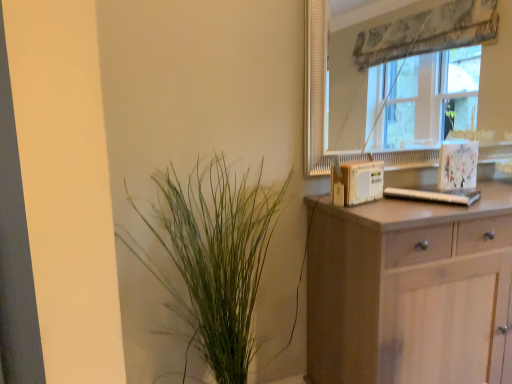
Question: From the image's perspective, does transparent glass window at upper right appear lower than light brown wooden chest of drawers at right?

Choices:
 (A) no
 (B) yes

Answer: (A)

Question: From a real-world perspective, is transparent glass window at upper right under light brown wooden chest of drawers at right?

Choices:
 (A) no
 (B) yes

Answer: (A)

Question: Is transparent glass window at upper right bigger than light brown wooden chest of drawers at right?

Choices:
 (A) no
 (B) yes

Answer: (A)

Question: From the image's perspective, is transparent glass window at upper right on top of light brown wooden chest of drawers at right?

Choices:
 (A) yes
 (B) no

Answer: (A)

Question: From a real-world perspective, is transparent glass window at upper right located higher than light brown wooden chest of drawers at right?

Choices:
 (A) yes
 (B) no

Answer: (A)

Question: Is transparent glass window at upper right in front of light brown wooden chest of drawers at right?

Choices:
 (A) no
 (B) yes

Answer: (A)

Question: Is green leafy plant at left taller than transparent glass window at upper right?

Choices:
 (A) yes
 (B) no

Answer: (A)

Question: Considering the relative sizes of green leafy plant at left and transparent glass window at upper right in the image provided, is green leafy plant at left smaller than transparent glass window at upper right?

Choices:
 (A) no
 (B) yes

Answer: (A)

Question: From a real-world perspective, is green leafy plant at left located beneath transparent glass window at upper right?

Choices:
 (A) yes
 (B) no

Answer: (A)

Question: Is green leafy plant at left wider than transparent glass window at upper right?

Choices:
 (A) no
 (B) yes

Answer: (B)

Question: From a real-world perspective, is green leafy plant at left positioned over transparent glass window at upper right based on gravity?

Choices:
 (A) no
 (B) yes

Answer: (A)

Question: Is green leafy plant at left positioned behind transparent glass window at upper right?

Choices:
 (A) yes
 (B) no

Answer: (B)

Question: Considering the relative sizes of light brown wooden chest of drawers at right and green leafy plant at left in the image provided, is light brown wooden chest of drawers at right wider than green leafy plant at left?

Choices:
 (A) yes
 (B) no

Answer: (A)